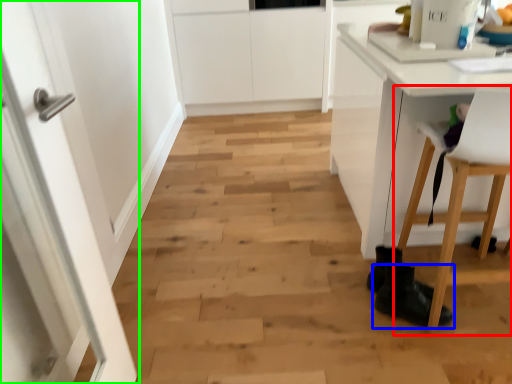
Question: Estimate the real-world distances between objects in this image. Which object is farther from chair (highlighted by a red box), footwear (highlighted by a blue box) or door (highlighted by a green box)?

Choices:
 (A) footwear
 (B) door

Answer: (B)